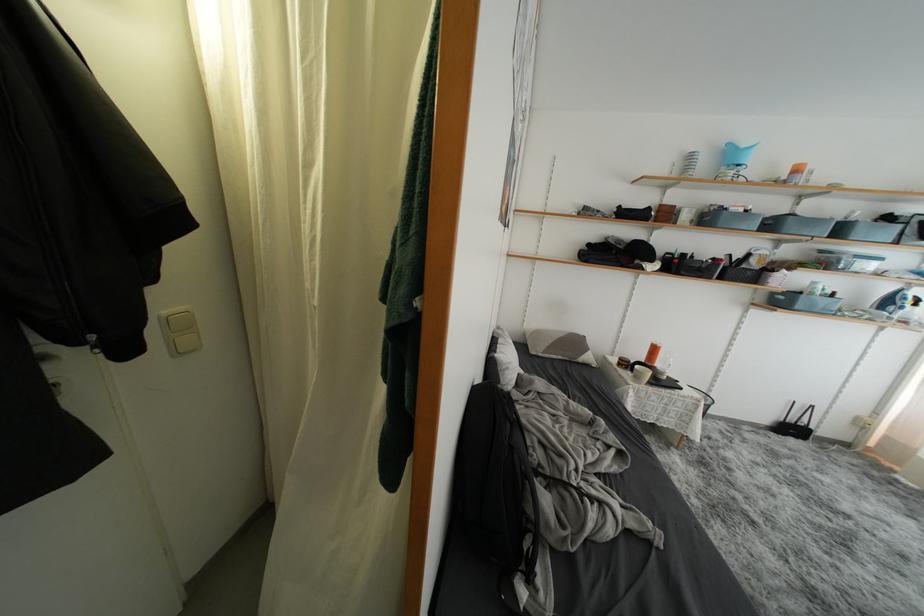
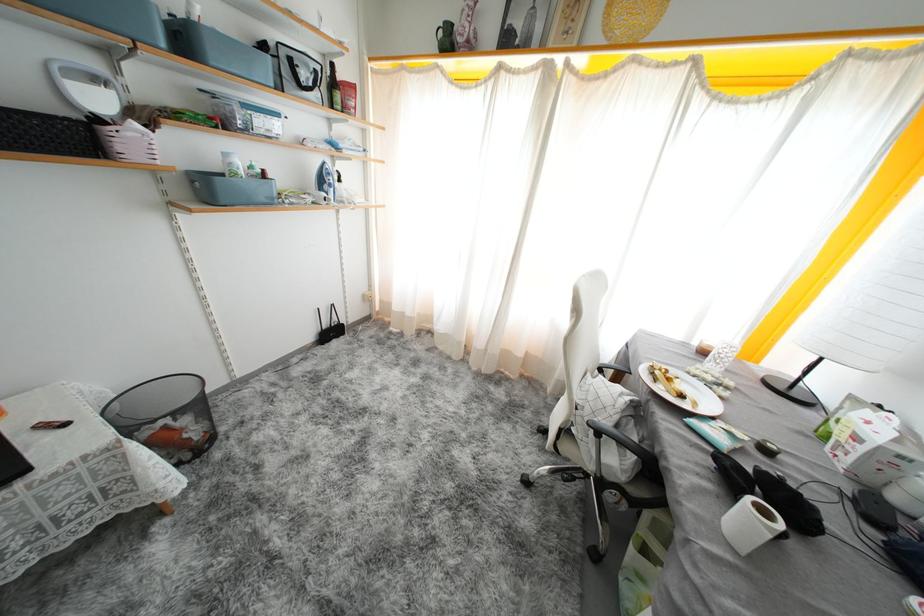
Where in the second image is the point corresponding to point 847,235 from the first image?

(190, 44)